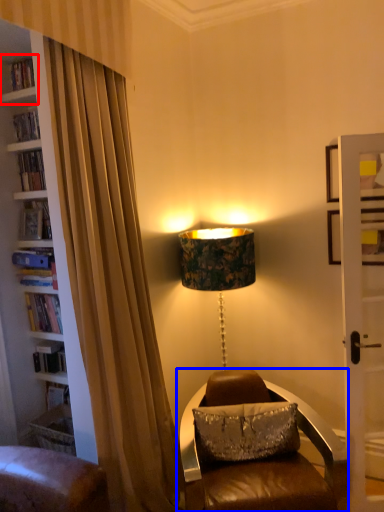
Question: Which of the following is the closest to the observer, shelf (highlighted by a red box) or chair (highlighted by a blue box)?

Choices:
 (A) shelf
 (B) chair

Answer: (B)